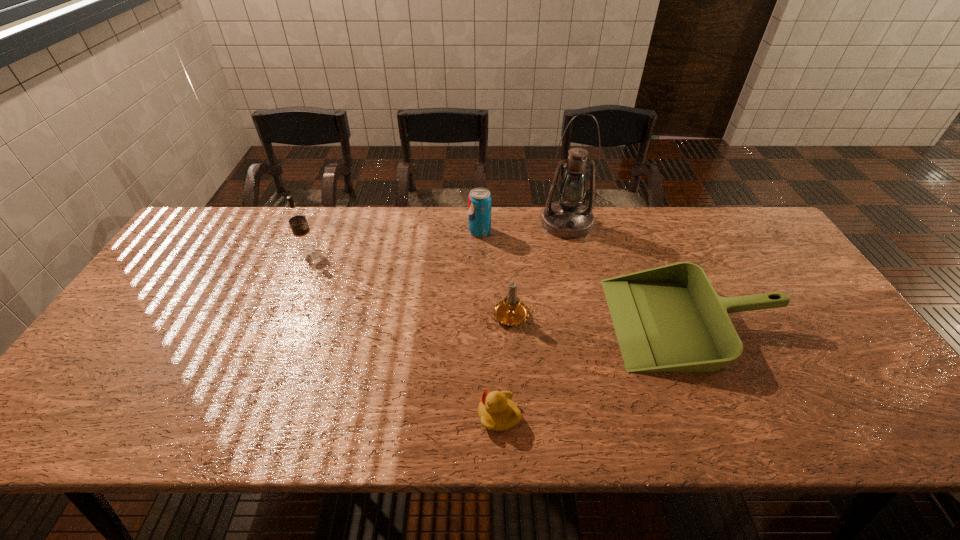
At what (x,y) coordinates should I click in order to perform the action: click on free space located 0.080m on the front of the third tallest object. Please return your answer as a coordinate pair (x, y). This screenshot has height=540, width=960. Looking at the image, I should click on (480, 255).

This screenshot has height=540, width=960. I want to click on free space located 0.360m on the right of the candle, so click(672, 315).

I want to click on free region located on the scoop of the second shortest object, so click(578, 322).

At what (x,y) coordinates should I click in order to perform the action: click on vacant space located 0.050m on the scoop of the second shortest object. Please return your answer as a coordinate pair (x, y). Looking at the image, I should click on (593, 322).

This screenshot has width=960, height=540. What are the coordinates of `free space located on the scoop of the second shortest object` in the screenshot? It's located at (525, 322).

The height and width of the screenshot is (540, 960). Identify the location of vacant space located on the front-facing side of the shortest object. (332, 415).

Where is `free space located 0.130m on the front-facing side of the shortest object`? Image resolution: width=960 pixels, height=540 pixels. free space located 0.130m on the front-facing side of the shortest object is located at coordinates (419, 415).

The height and width of the screenshot is (540, 960). I want to click on free space located on the front-facing side of the shortest object, so click(x=405, y=415).

At what (x,y) coordinates should I click in order to perform the action: click on oil lamp that is positioned at the far edge. Please return your answer as a coordinate pair (x, y). The width and height of the screenshot is (960, 540). Looking at the image, I should click on (568, 218).

Where is `vodka that is at the far edge`? vodka that is at the far edge is located at coordinates (296, 217).